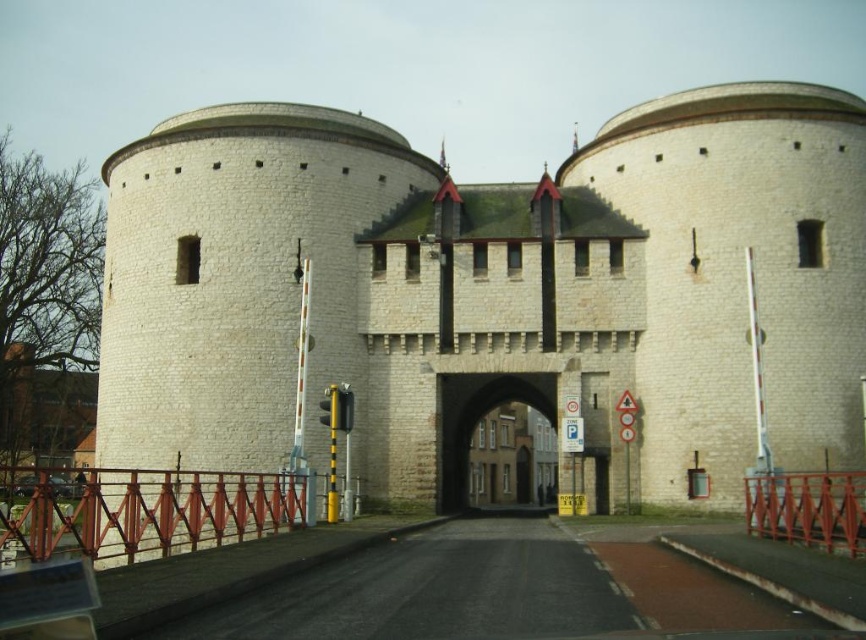
You are a tourist standing in front of the historic gate structure. You notice the white stone castle at center and the white stone archway at center. Which one is closer to you?

The white stone castle at center is closer to you because it is in front of the white stone archway at center.

You are standing in front of the historic gate structure. You notice two points marked on the gate. The first point is at coordinates point (519, 298) and the second is at point (450, 387). Which point is nearer to you?

Point (519, 298) is closer to the viewer than point (450, 387).

In the scene shown: You are a tour guide leading a group to the historic site. You want to inform your group about the distance between the two structures. How far apart are the white stone castle at center and the white stone archway at center?

The white stone castle at center and the white stone archway at center are 50.91 feet apart from each other.